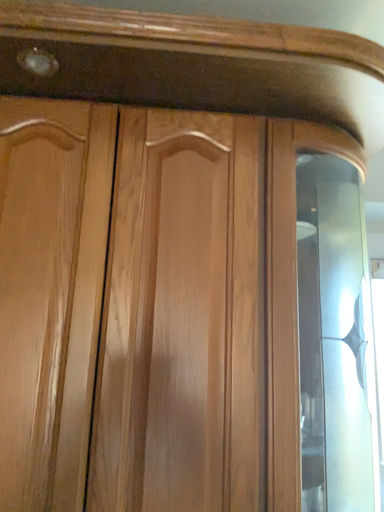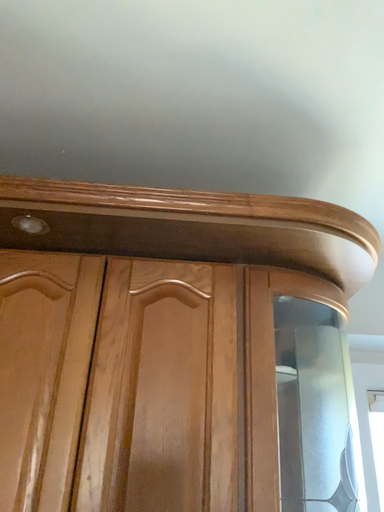
Question: How did the camera likely rotate when shooting the video?

Choices:
 (A) rotated upward
 (B) rotated downward

Answer: (A)